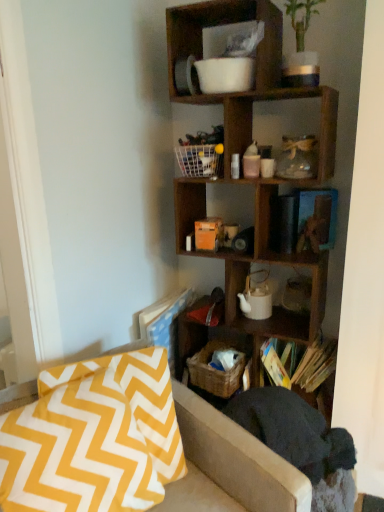
Question: Considering the relative sizes of dark gray fabric swivel chair at lower right and woven brown basket at lower center in the image provided, is dark gray fabric swivel chair at lower right wider than woven brown basket at lower center?

Choices:
 (A) no
 (B) yes

Answer: (B)

Question: Is dark gray fabric swivel chair at lower right behind woven brown basket at lower center?

Choices:
 (A) no
 (B) yes

Answer: (A)

Question: From a real-world perspective, is dark gray fabric swivel chair at lower right on woven brown basket at lower center?

Choices:
 (A) no
 (B) yes

Answer: (A)

Question: From the image's perspective, is dark gray fabric swivel chair at lower right located beneath woven brown basket at lower center?

Choices:
 (A) yes
 (B) no

Answer: (A)

Question: Is dark gray fabric swivel chair at lower right not near woven brown basket at lower center?

Choices:
 (A) no
 (B) yes

Answer: (A)

Question: In terms of size, does wooden cube at upper right appear bigger or smaller than white wire basket at center?

Choices:
 (A) big
 (B) small

Answer: (A)

Question: Visually, is wooden cube at upper right positioned to the left or to the right of white wire basket at center?

Choices:
 (A) left
 (B) right

Answer: (B)

Question: Is wooden cube at upper right wider or thinner than white wire basket at center?

Choices:
 (A) wide
 (B) thin

Answer: (A)

Question: From a real-world perspective, is wooden cube at upper right positioned above or below white wire basket at center?

Choices:
 (A) below
 (B) above

Answer: (A)

Question: Is yellow zigzag fabric pillow at lower left situated inside woven brown basket at lower center or outside?

Choices:
 (A) outside
 (B) inside

Answer: (A)

Question: From the image's perspective, is yellow zigzag fabric pillow at lower left positioned above or below woven brown basket at lower center?

Choices:
 (A) above
 (B) below

Answer: (B)

Question: Does point (114, 355) appear closer or farther from the camera than point (213, 343)?

Choices:
 (A) closer
 (B) farther

Answer: (A)

Question: In terms of size, does yellow zigzag fabric pillow at lower left appear bigger or smaller than woven brown basket at lower center?

Choices:
 (A) big
 (B) small

Answer: (A)

Question: From a real-world perspective, is yellow zigzag fabric pillow at lower left above or below wooden book at lower right?

Choices:
 (A) below
 (B) above

Answer: (B)

Question: Based on their sizes in the image, would you say yellow zigzag fabric pillow at lower left is bigger or smaller than wooden book at lower right?

Choices:
 (A) small
 (B) big

Answer: (B)